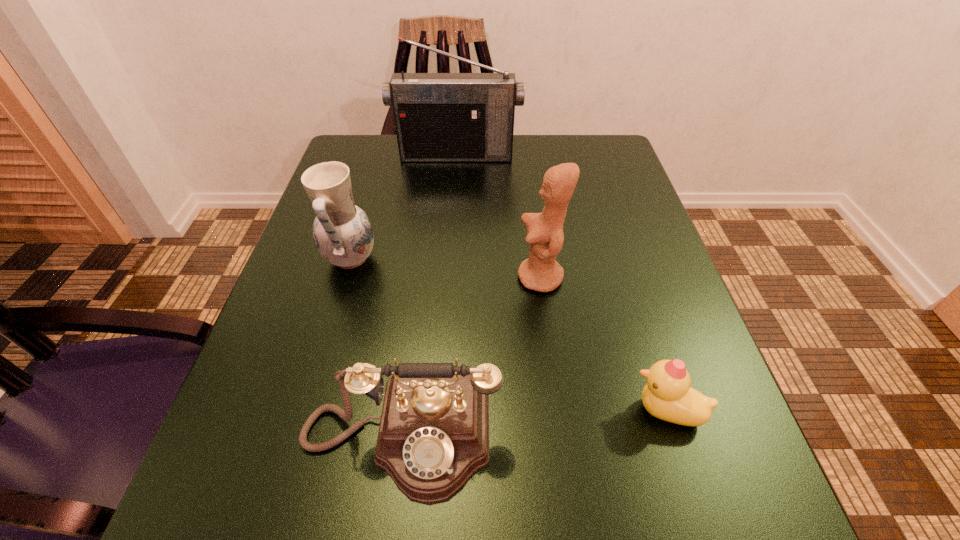
Locate an element on the screen. The image size is (960, 540). the farthest object is located at coordinates (439, 117).

You are a GUI agent. You are given a task and a screenshot of the screen. Output one action in this format:
    pyautogui.click(x=<x>, y=<y>)
    Task: Click on the figurine
    The height and width of the screenshot is (540, 960).
    Given the screenshot: What is the action you would take?
    pyautogui.click(x=541, y=272)

I want to click on the third tallest object, so click(343, 234).

At what (x,y) coordinates should I click in order to perform the action: click on telephone. Please return your answer as a coordinate pair (x, y). The image size is (960, 540). Looking at the image, I should click on (433, 436).

I want to click on the shortest object, so click(x=668, y=395).

Locate an element on the screen. This screenshot has height=540, width=960. duckling is located at coordinates (668, 395).

You are a GUI agent. You are given a task and a screenshot of the screen. Output one action in this format:
    pyautogui.click(x=<x>, y=<y>)
    Task: Click on the free space located on the front-facing side of the farthest object
    The height and width of the screenshot is (540, 960).
    Given the screenshot: What is the action you would take?
    pyautogui.click(x=451, y=234)

Image resolution: width=960 pixels, height=540 pixels. In order to click on vacant position located 0.280m on the front-facing side of the figurine in this screenshot , I will do (x=368, y=278).

Find the location of `free space located 0.050m on the front-facing side of the figurine`. free space located 0.050m on the front-facing side of the figurine is located at coordinates [491, 278].

The width and height of the screenshot is (960, 540). What are the coordinates of `free space located 0.120m on the front-facing side of the figurine` in the screenshot? It's located at (453, 278).